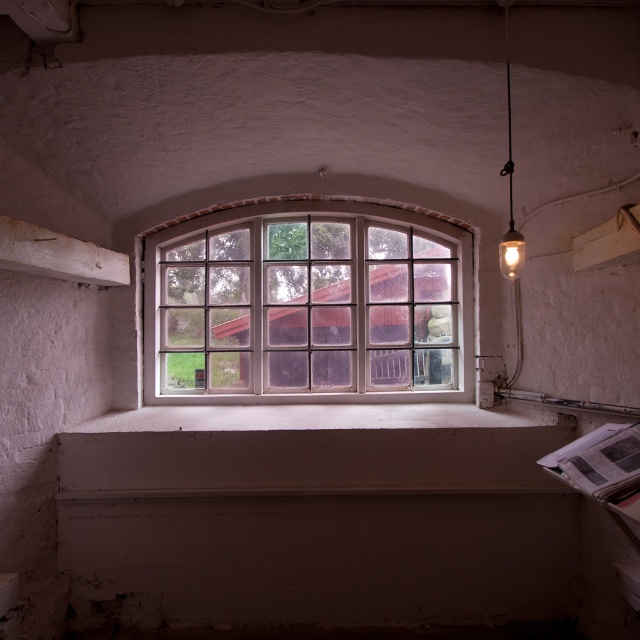
Question: Estimate the real-world distances between objects in this image. Which object is farther from the white wooden window frame at center?

Choices:
 (A) white concrete window sill at center
 (B) matte glass bulb at upper right
 (C) white wooden beam at left

Answer: (B)

Question: Among these objects, which one is farthest from the camera?

Choices:
 (A) white concrete window sill at center
 (B) white wooden window frame at center

Answer: (B)

Question: Can you confirm if white wooden window frame at center is thinner than matte glass bulb at upper right?

Choices:
 (A) no
 (B) yes

Answer: (A)

Question: Where is white wooden window frame at center located in relation to white concrete window sill at center in the image?

Choices:
 (A) above
 (B) below

Answer: (A)

Question: Which object is farther from the camera taking this photo?

Choices:
 (A) matte glass bulb at upper right
 (B) white wooden window frame at center
 (C) white concrete window sill at center

Answer: (B)

Question: Is white wooden beam at left wider than matte glass bulb at upper right?

Choices:
 (A) yes
 (B) no

Answer: (B)